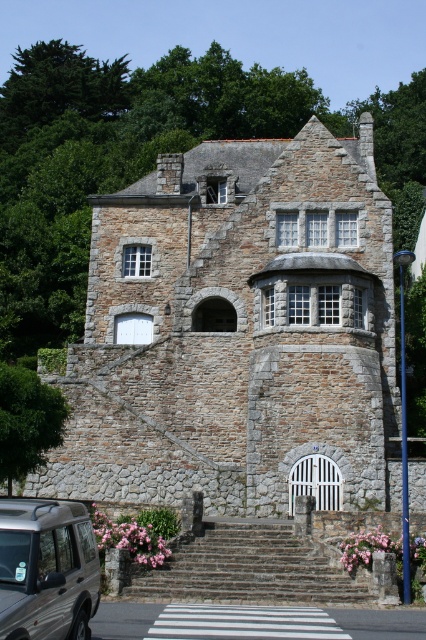
You are standing in front of the stone building and notice two points marked on its facade. The first point is at coordinates point (287, 547) and the second is at point (68, 552). Which of these points is closer to you?

Point (287, 547) is further to the viewer than point (68, 552), so the point closer to you is point (68, 552).

You are standing at the entrance of the stone building and want to reach the upper floor. Where are the brown stone stairs at center located relative to your current position?

The brown stone stairs at center are located at coordinates point (x=249, y=568), which is to the center of the building. Since you are at the entrance, the stairs are directly ahead of you in the central area.

You are a delivery person trying to reach the entrance of the stone building. You see the brown stone stairs at center and the metallic silver suv at lower left. Which object is closer to the entrance?

The brown stone stairs at center is positioned under the metallic silver suv at lower left, meaning the stairs are closer to the entrance than the SUV.